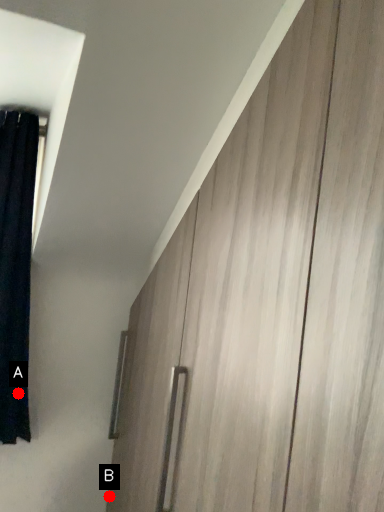
Question: Two points are circled on the image, labeled by A and B beside each circle. Among these points, which one is nearest to the camera?

Choices:
 (A) A is closer
 (B) B is closer

Answer: (A)